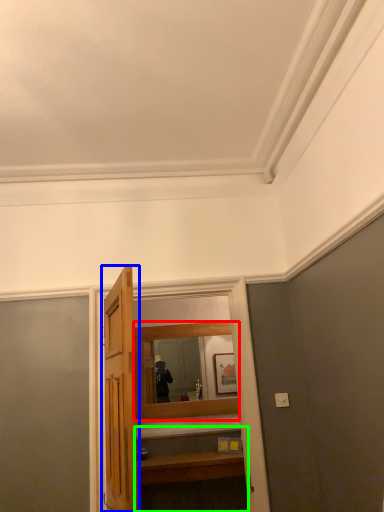
Question: Which is nearer to the mirror (highlighted by a red box)? door (highlighted by a blue box) or vanity (highlighted by a green box).

Choices:
 (A) door
 (B) vanity

Answer: (B)